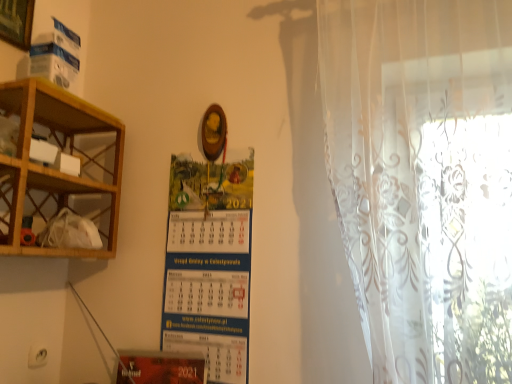
Question: Is transparent floral curtain at right surrounding blue paper calendar at center?

Choices:
 (A) no
 (B) yes

Answer: (A)

Question: From a real-world perspective, does transparent floral curtain at right stand above blue paper calendar at center?

Choices:
 (A) yes
 (B) no

Answer: (A)

Question: Can you confirm if transparent floral curtain at right is wider than blue paper calendar at center?

Choices:
 (A) no
 (B) yes

Answer: (B)

Question: Can you confirm if transparent floral curtain at right is smaller than blue paper calendar at center?

Choices:
 (A) yes
 (B) no

Answer: (B)

Question: From the image's perspective, is transparent floral curtain at right located above blue paper calendar at center?

Choices:
 (A) no
 (B) yes

Answer: (B)

Question: In terms of height, does wooden shelf at left look taller or shorter compared to wooden picture frame at upper left?

Choices:
 (A) tall
 (B) short

Answer: (A)

Question: From a real-world perspective, is wooden shelf at left above or below wooden picture frame at upper left?

Choices:
 (A) above
 (B) below

Answer: (B)

Question: Looking at the image, does wooden shelf at left seem bigger or smaller compared to wooden picture frame at upper left?

Choices:
 (A) small
 (B) big

Answer: (B)

Question: Considering the positions of wooden shelf at left and wooden picture frame at upper left in the image, is wooden shelf at left wider or thinner than wooden picture frame at upper left?

Choices:
 (A) thin
 (B) wide

Answer: (B)

Question: In terms of width, does wooden picture frame at upper left look wider or thinner when compared to wooden shelf at left?

Choices:
 (A) thin
 (B) wide

Answer: (A)

Question: Is wooden picture frame at upper left inside or outside of wooden shelf at left?

Choices:
 (A) inside
 (B) outside

Answer: (B)

Question: Considering the positions of wooden picture frame at upper left and wooden shelf at left in the image, is wooden picture frame at upper left taller or shorter than wooden shelf at left?

Choices:
 (A) short
 (B) tall

Answer: (A)

Question: Would you say wooden picture frame at upper left is to the left or to the right of wooden shelf at left in the picture?

Choices:
 (A) right
 (B) left

Answer: (B)

Question: From a real-world perspective, is blue paper calendar at center above or below transparent floral curtain at right?

Choices:
 (A) above
 (B) below

Answer: (B)

Question: Considering the relative positions of blue paper calendar at center and transparent floral curtain at right in the image provided, is blue paper calendar at center to the left or to the right of transparent floral curtain at right?

Choices:
 (A) left
 (B) right

Answer: (A)